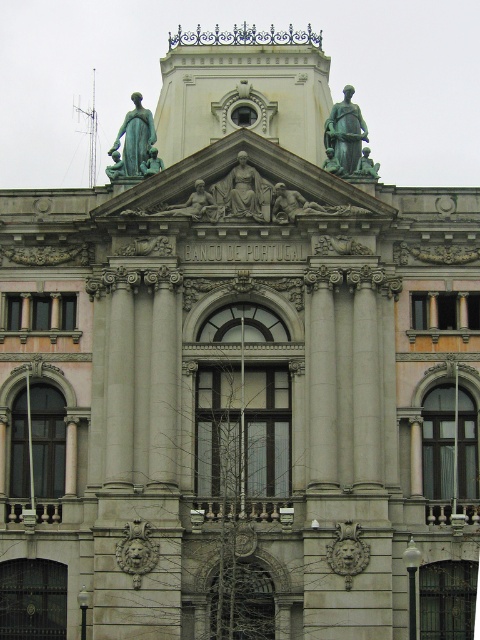
You are an art student analyzing the statues on the Banco de Portugal building. You notice two statues, the green patina statue at upper center and the matte gray stone statue at center. Which of these statues is placed higher up on the building?

The green patina statue at upper center is positioned over the matte gray stone statue at center, meaning it is placed higher up on the building.